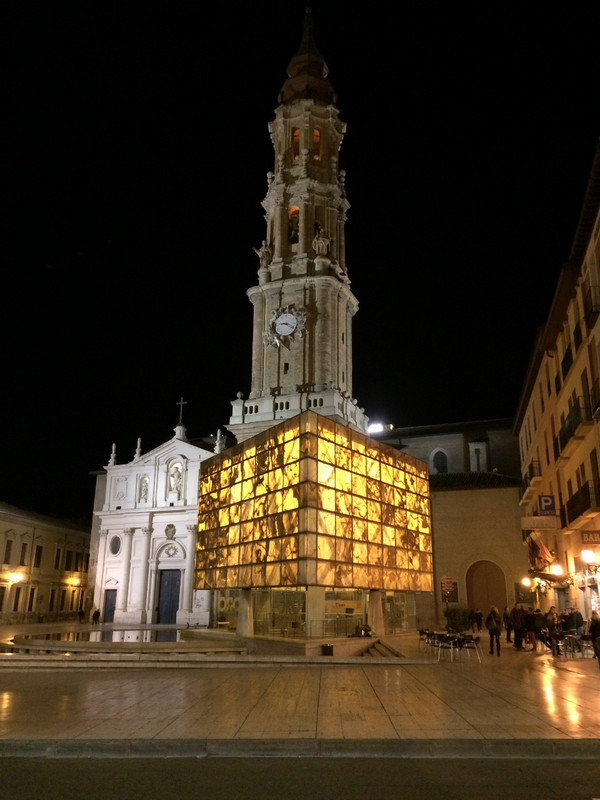
Identify the location of floor. (303, 706).